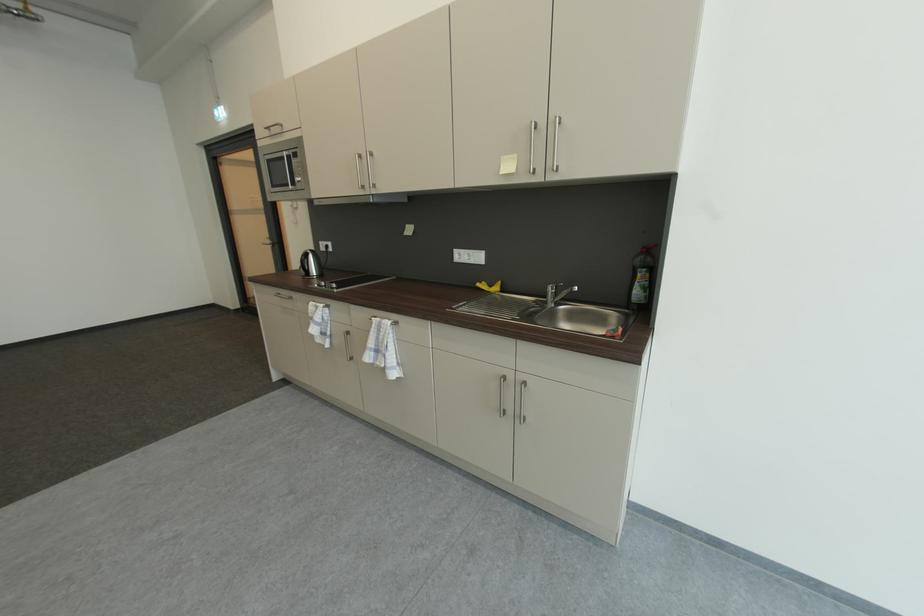
Where would you lift the faucet handle? Please return your answer as a coordinate pair (x, y).

(560, 294)